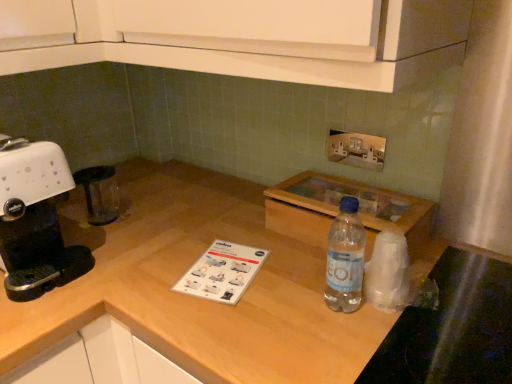
Question: Is white plastic coffee machine at left spatially inside transparent plastic bag at right, or outside of it?

Choices:
 (A) inside
 (B) outside

Answer: (B)

Question: In the image, is white plastic coffee machine at left on the left side or the right side of transparent plastic bag at right?

Choices:
 (A) right
 (B) left

Answer: (B)

Question: Which is nearer to the wooden at center?

Choices:
 (A) metallic silver outlet at upper center
 (B) white plastic coffee machine at left
 (C) transparent plastic bag at right
 (D) clear plastic bottle at center

Answer: (B)

Question: Considering the real-world distances, which object is closest to the wooden at center?

Choices:
 (A) metallic silver outlet at upper center
 (B) transparent plastic bag at right
 (C) clear plastic bottle at center
 (D) white plastic coffee machine at left

Answer: (D)